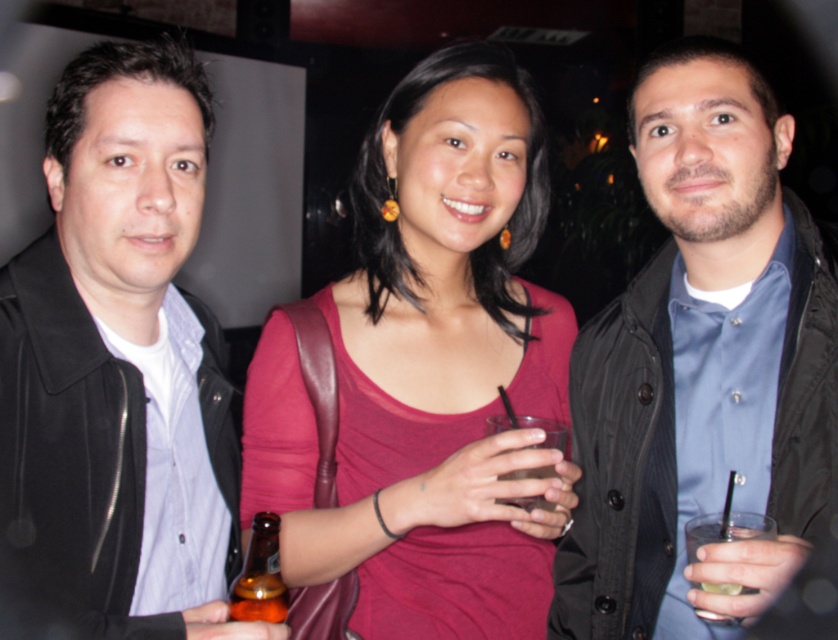
You are at a party and want to choose the smaller clear glass to drink your beverage. Which one should you pick between the clear glass at right and the clear glass at center?

The clear glass at right is smaller than the clear glass at center, so you should pick the clear glass at right to drink your beverage.

You are at a bar and need to choose between the black leather jacket at left and the matte black jacket at center to place on a coat rack that requires jackets to be at least 28 inches in length. Which jacket meets the requirement?

The matte black jacket at center is taller than the black leather jacket at left. Since the coat rack requires jackets to be at least 28 inches long, the matte black jacket at center likely meets the requirement, while the black leather jacket at left may be too short.